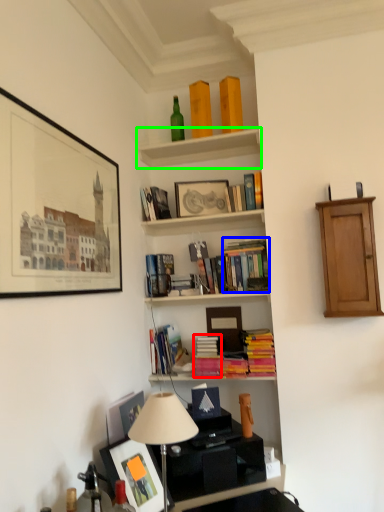
Question: Considering the real-world distances, which object is farthest from book (highlighted by a red box)? book (highlighted by a blue box) or shelf (highlighted by a green box)?

Choices:
 (A) book
 (B) shelf

Answer: (B)